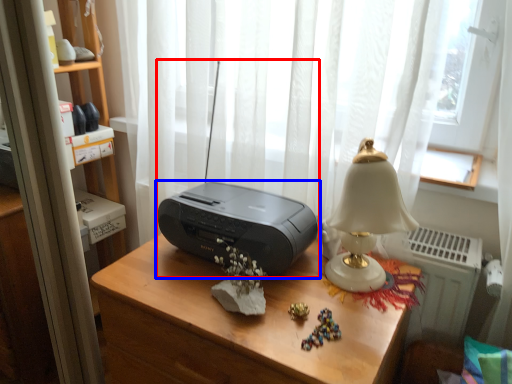
Question: Which of the following is the closest to the observer, stereo (highlighted by a red box) or printer (highlighted by a blue box)?

Choices:
 (A) stereo
 (B) printer

Answer: (A)